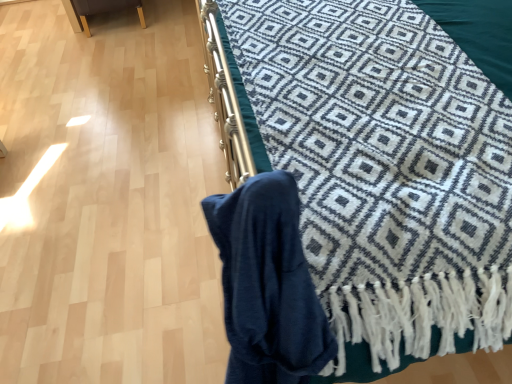
What do you see at coordinates (386, 154) in the screenshot? This screenshot has height=384, width=512. I see `dark blue fabric at lower right` at bounding box center [386, 154].

Identify the location of dark blue fabric at lower right. (386, 154).

Identify the location of dark blue fabric at lower right. (386, 154).